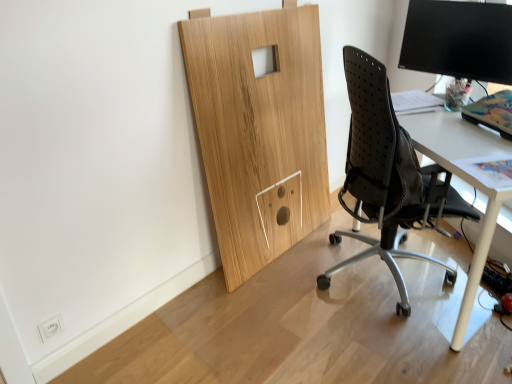
The height and width of the screenshot is (384, 512). Identify the location of free space underneath black mesh chair at right (from a real-world perspective). (354, 278).